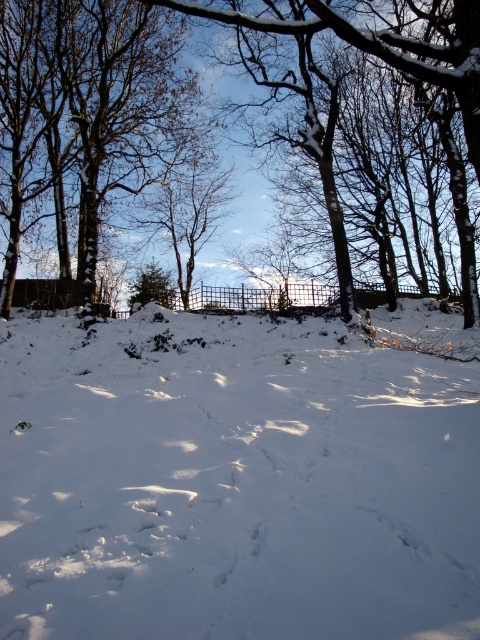
In the scene shown: You are standing in the winter scene and want to place a small decorative snowman exactly at the point marked as point (x=233, y=483). What will the snowman be placed on?

The snowman will be placed on the white powdery snow at lower center, as point (x=233, y=483) corresponds to that location.

You are standing at the point with coordinates point (38, 22) and want to walk towards the point with coordinates point (432, 490). Which direction should you face to walk directly towards your destination?

You should face north because point (432, 490) is in front of point (38, 22), indicating it is north of your current position.